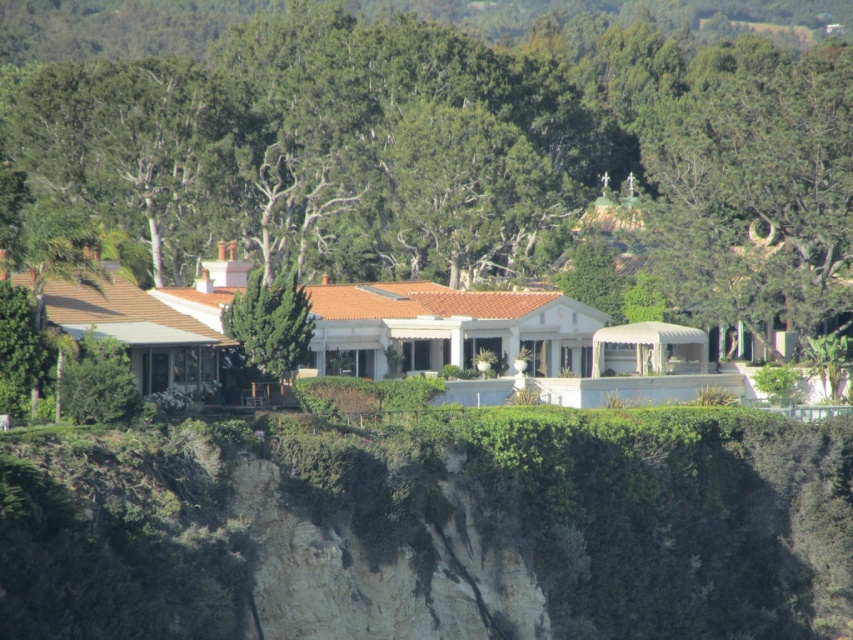
Can you confirm if green leafy tree at center is taller than green textured tree at center?

Yes, green leafy tree at center is taller than green textured tree at center.

Is point (94, 100) positioned in front of point (294, 292)?

No, (94, 100) is further to viewer.

Is point (810, 227) in front of point (287, 348)?

No, it is behind (287, 348).

Locate an element on the screen. Image resolution: width=853 pixels, height=640 pixels. green leafy tree at center is located at coordinates coord(465,152).

Does green mossy cliff at lower center have a larger size compared to green textured tree at center?

Answer: Yes, green mossy cliff at lower center is bigger than green textured tree at center.

Does point (167, 604) lie in front of point (245, 353)?

Yes, it is.

At what (x,y) coordinates should I click in order to perform the action: click on green mossy cliff at lower center. Please return your answer as a coordinate pair (x, y). This screenshot has height=640, width=853. Looking at the image, I should click on (616, 513).

Does green leafy tree at center have a greater height compared to green mossy cliff at lower center?

Yes, green leafy tree at center is taller than green mossy cliff at lower center.

Can you confirm if green leafy tree at center is positioned to the left of green mossy cliff at lower center?

No, green leafy tree at center is not to the left of green mossy cliff at lower center.

Does point (838, 262) come closer to viewer compared to point (370, 481)?

No, it is behind (370, 481).

The width and height of the screenshot is (853, 640). Find the location of `green leafy tree at center`. green leafy tree at center is located at coordinates (465, 152).